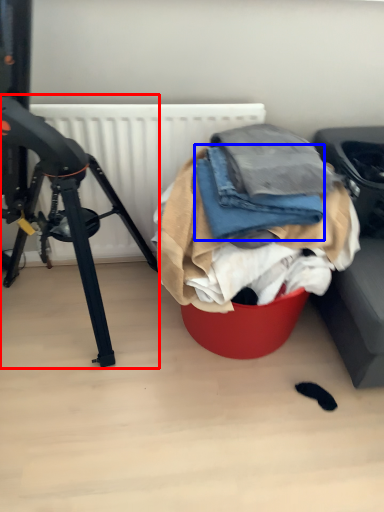
Question: Which of the following is the farthest to the observer, tripod (highlighted by a red box) or clothing (highlighted by a blue box)?

Choices:
 (A) tripod
 (B) clothing

Answer: (B)